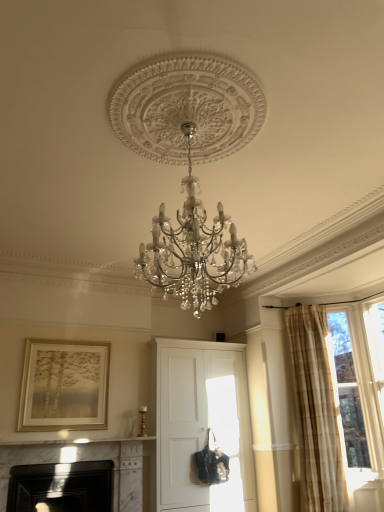
Locate an element on the screen. The width and height of the screenshot is (384, 512). white matte cabinet at center is located at coordinates (200, 424).

Measure the distance between point (118, 478) and camera.

Point (118, 478) is 4.39 meters away from camera.

The width and height of the screenshot is (384, 512). What do you see at coordinates (349, 393) in the screenshot?
I see `clear glass window at upper right` at bounding box center [349, 393].

Where is `beige plaid curtain at right`? This screenshot has height=512, width=384. beige plaid curtain at right is located at coordinates (316, 410).

Does white matte cabinet at center contain clear glass window at upper right?

No, clear glass window at upper right is not surrounded by white matte cabinet at center.

From the image's perspective, is white matte cabinet at center under clear glass window at upper right?

Correct, white matte cabinet at center appears lower than clear glass window at upper right in the image.

Can you confirm if white matte cabinet at center is bigger than clear glass window at upper right?

Yes, white matte cabinet at center is bigger than clear glass window at upper right.

Who is taller, white matte cabinet at center or clear glass window at upper right?

white matte cabinet at center.

Which is closer to the camera, (113,441) or (28,479)?

The point (28,479) is in front.

From the image's perspective, which is above, white marble fireplace at lower left, which appears as the 1th fireplace when viewed from the right, or black marble fireplace at lower left, arranged as the second fireplace when viewed from the right?

white marble fireplace at lower left, which appears as the 1th fireplace when viewed from the right.

Looking at this image, could you tell me if white marble fireplace at lower left, placed as the second fireplace when sorted from left to right, is facing black marble fireplace at lower left, the 1th fireplace positioned from the left?

Yes, white marble fireplace at lower left, placed as the second fireplace when sorted from left to right, faces towards black marble fireplace at lower left, the 1th fireplace positioned from the left.

Considering the sizes of white marble fireplace at lower left, placed as the second fireplace when sorted from left to right, and black marble fireplace at lower left, arranged as the second fireplace when viewed from the right, in the image, is white marble fireplace at lower left, placed as the second fireplace when sorted from left to right, taller or shorter than black marble fireplace at lower left, arranged as the second fireplace when viewed from the right,?

In the image, white marble fireplace at lower left, placed as the second fireplace when sorted from left to right, appears to be taller than black marble fireplace at lower left, arranged as the second fireplace when viewed from the right.

Is white matte cabinet at center beside gold metallic picture frame at upper left?

white matte cabinet at center and gold metallic picture frame at upper left are not in contact.

Who is bigger, white matte cabinet at center or gold metallic picture frame at upper left?

Bigger between the two is white matte cabinet at center.

Is point (194, 359) positioned in front of point (78, 347)?

No, (194, 359) is behind (78, 347).

Does white matte cabinet at center turn towards gold metallic picture frame at upper left?

No, white matte cabinet at center is not aimed at gold metallic picture frame at upper left.

Is beige plaid curtain at right aimed at clear glass window at upper right?

No, beige plaid curtain at right is not turned towards clear glass window at upper right.

Does beige plaid curtain at right have a smaller size compared to clear glass window at upper right?

Incorrect, beige plaid curtain at right is not smaller in size than clear glass window at upper right.

Considering the sizes of objects beige plaid curtain at right and clear glass window at upper right in the image provided, who is thinner, beige plaid curtain at right or clear glass window at upper right?

→ Thinner between the two is clear glass window at upper right.

Image resolution: width=384 pixels, height=512 pixels. Find the location of `bay window in front of the gold metallic picture frame at upper left`. bay window in front of the gold metallic picture frame at upper left is located at coordinates (349, 393).

Does gold metallic picture frame at upper left have a greater height compared to clear glass window at upper right?

No.

Based on the photo, how many degrees apart are the facing directions of gold metallic picture frame at upper left and clear glass window at upper right?

89.6 degrees.

Do you think gold metallic picture frame at upper left is within clear glass window at upper right, or outside of it?

gold metallic picture frame at upper left is spatially situated outside clear glass window at upper right.

In the scene shown: Considering the sizes of white marble fireplace at lower left, which appears as the 1th fireplace when viewed from the right, and clear glass window at upper right in the image, is white marble fireplace at lower left, which appears as the 1th fireplace when viewed from the right, wider or thinner than clear glass window at upper right?

white marble fireplace at lower left, which appears as the 1th fireplace when viewed from the right, is wider than clear glass window at upper right.

Who is smaller, white marble fireplace at lower left, placed as the second fireplace when sorted from left to right, or clear glass window at upper right?

Smaller between the two is clear glass window at upper right.

Can you confirm if white marble fireplace at lower left, placed as the second fireplace when sorted from left to right, is positioned to the right of clear glass window at upper right?

No.

Is gold metallic picture frame at upper left thinner than black marble fireplace at lower left, the 1th fireplace positioned from the left?

Yes.

From the image's perspective, which one is positioned higher, gold metallic picture frame at upper left or black marble fireplace at lower left, arranged as the second fireplace when viewed from the right?

From the image's view, gold metallic picture frame at upper left is above.

Would you say gold metallic picture frame at upper left is outside black marble fireplace at lower left, arranged as the second fireplace when viewed from the right?

Indeed, gold metallic picture frame at upper left is completely outside black marble fireplace at lower left, arranged as the second fireplace when viewed from the right.

This screenshot has height=512, width=384. Find the location of `bay window lying above the white matte cabinet at center (from the image's perspective)`. bay window lying above the white matte cabinet at center (from the image's perspective) is located at coordinates (349, 393).

I want to click on fireplace located in front of the black marble fireplace at lower left, arranged as the second fireplace when viewed from the right, so click(90, 460).

Considering their positions, is beige plaid curtain at right positioned closer to gold metallic picture frame at upper left than black marble fireplace at lower left, arranged as the second fireplace when viewed from the right?

Based on the image, black marble fireplace at lower left, arranged as the second fireplace when viewed from the right, appears to be nearer to gold metallic picture frame at upper left.

When comparing their distances from gold metallic picture frame at upper left, does white marble fireplace at lower left, placed as the second fireplace when sorted from left to right, or beige plaid curtain at right seem further?

Among the two, beige plaid curtain at right is located further to gold metallic picture frame at upper left.

Based on their spatial positions, is white marble fireplace at lower left, placed as the second fireplace when sorted from left to right, or clear glass window at upper right further from gold metallic picture frame at upper left?

Among the two, clear glass window at upper right is located further to gold metallic picture frame at upper left.

Based on their spatial positions, is white matte cabinet at center or white marble fireplace at lower left, placed as the second fireplace when sorted from left to right, closer to beige plaid curtain at right?

The object closer to beige plaid curtain at right is white matte cabinet at center.

Considering their positions, is gold metallic picture frame at upper left positioned further to clear glass window at upper right than black marble fireplace at lower left, the 1th fireplace positioned from the left?

black marble fireplace at lower left, the 1th fireplace positioned from the left, is positioned further to the anchor clear glass window at upper right.

Based on their spatial positions, is clear glass window at upper right or white matte cabinet at center closer to beige plaid curtain at right?

clear glass window at upper right.

Considering their positions, is black marble fireplace at lower left, arranged as the second fireplace when viewed from the right, positioned closer to beige plaid curtain at right than clear glass window at upper right?

The object closer to beige plaid curtain at right is clear glass window at upper right.

Estimate the real-world distances between objects in this image. Which object is closer to beige plaid curtain at right, clear glass window at upper right or white marble fireplace at lower left, which appears as the 1th fireplace when viewed from the right?

clear glass window at upper right.

The height and width of the screenshot is (512, 384). In order to click on curtain situated between gold metallic picture frame at upper left and clear glass window at upper right from left to right in this screenshot , I will do `click(316, 410)`.

Image resolution: width=384 pixels, height=512 pixels. I want to click on cabinetry between gold metallic picture frame at upper left and clear glass window at upper right, so click(200, 424).

Where is `curtain between black marble fireplace at lower left, the 1th fireplace positioned from the left, and clear glass window at upper right, in the horizontal direction`? curtain between black marble fireplace at lower left, the 1th fireplace positioned from the left, and clear glass window at upper right, in the horizontal direction is located at coordinates (316, 410).

Locate an element on the screen. fireplace between black marble fireplace at lower left, arranged as the second fireplace when viewed from the right, and white matte cabinet at center from left to right is located at coordinates (90, 460).